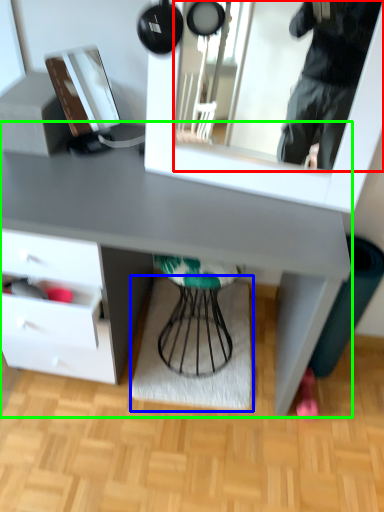
Question: Estimate the real-world distances between objects in this image. Which object is closer to mirror (highlighted by a red box), mat (highlighted by a blue box) or desk (highlighted by a green box)?

Choices:
 (A) mat
 (B) desk

Answer: (B)